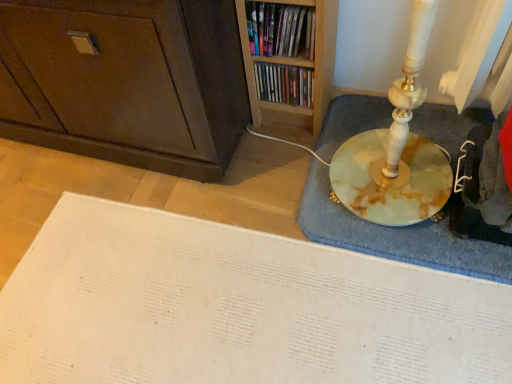
Question: Considering the relative positions of dark brown wood cabinet at lower left and marble bath mat at right in the image provided, is dark brown wood cabinet at lower left to the left or to the right of marble bath mat at right?

Choices:
 (A) left
 (B) right

Answer: (A)

Question: Would you say dark brown wood cabinet at lower left is inside or outside marble bath mat at right?

Choices:
 (A) outside
 (B) inside

Answer: (A)

Question: Which is farther from the dark brown wood cabinet at lower left?

Choices:
 (A) matte plastic books at upper center, which appears as the second book when viewed from the front
 (B) wooden bookshelf at upper center, arranged as the second book when viewed from the back
 (C) marble bath mat at right

Answer: (C)

Question: Based on their relative distances, which object is farther from the dark brown wood cabinet at lower left?

Choices:
 (A) wooden bookshelf at upper center, the first book when ordered from front to back
 (B) marble bath mat at right
 (C) matte plastic books at upper center, which appears as the second book when viewed from the front

Answer: (B)